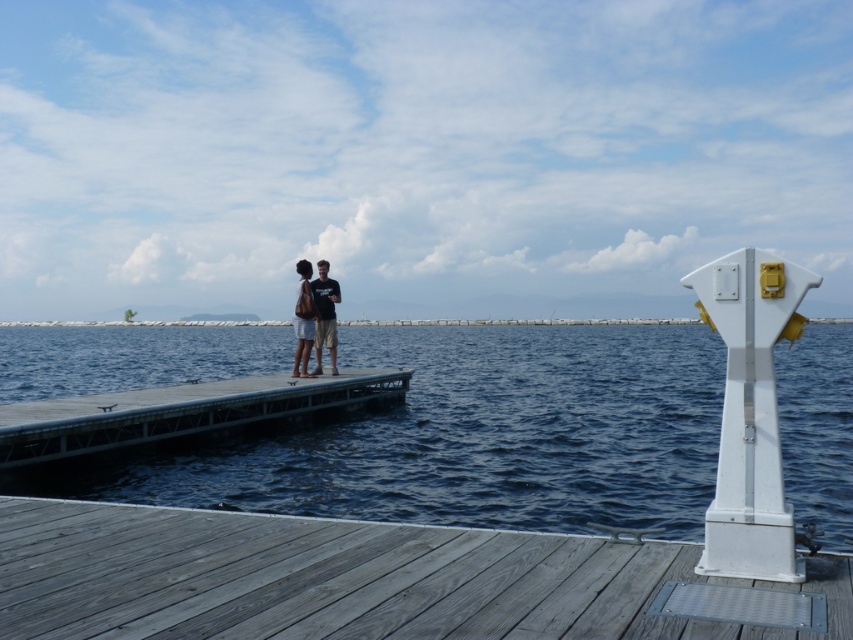
Question: Among these points, which one is nearest to the camera?

Choices:
 (A) (328, 308)
 (B) (250, 636)
 (C) (129, 429)

Answer: (B)

Question: Can you confirm if blue water at center is positioned above matte black t-shirt at center?

Choices:
 (A) no
 (B) yes

Answer: (A)

Question: Which object is the farthest from the gray wooden dock at lower center?

Choices:
 (A) matte black t-shirt at center
 (B) gray concrete dock at center
 (C) blue water at center

Answer: (C)

Question: Does blue water at center appear under gray concrete dock at center?

Choices:
 (A) yes
 (B) no

Answer: (B)

Question: Does blue water at center appear under matte black t-shirt at center?

Choices:
 (A) no
 (B) yes

Answer: (B)

Question: Which object appears closest to the camera in this image?

Choices:
 (A) gray wooden dock at lower center
 (B) matte black t-shirt at center
 (C) blue water at center
 (D) gray concrete dock at center

Answer: (A)